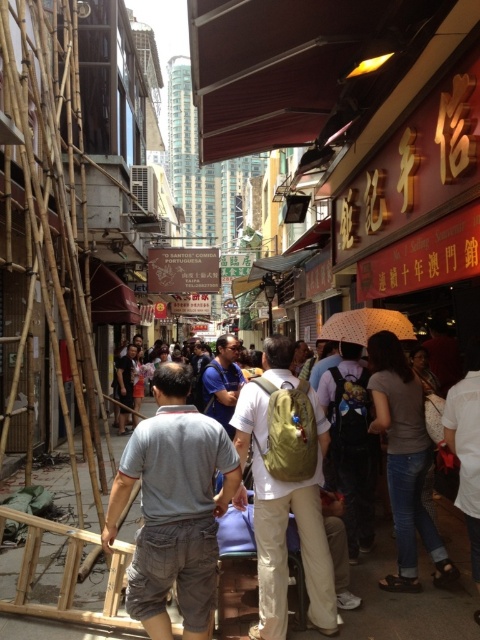
Question: Which point is closer to the camera?

Choices:
 (A) white matte umbrella at center
 (B) blue fabric shirt at center

Answer: (B)

Question: Which object is farther from the camera taking this photo?

Choices:
 (A) light blue fabric at center
 (B) white matte umbrella at center
 (C) green fabric backpack at center
 (D) blue fabric shirt at center

Answer: (B)

Question: Does green fabric backpack at center appear on the right side of white matte umbrella at center?

Choices:
 (A) no
 (B) yes

Answer: (A)

Question: Based on their relative distances, which object is farther from the light blue fabric at center?

Choices:
 (A) gray fabric pants at center
 (B) blue fabric shirt at center

Answer: (B)

Question: Is green fabric backpack at center smaller than white matte umbrella at center?

Choices:
 (A) yes
 (B) no

Answer: (B)

Question: Is green fabric backpack at center positioned at the back of white matte umbrella at center?

Choices:
 (A) yes
 (B) no

Answer: (B)